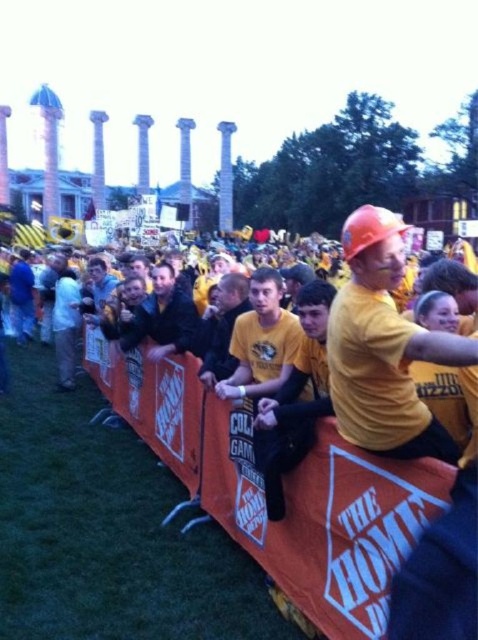
Question: Which point appears closest to the camera in this image?

Choices:
 (A) (90, 372)
 (B) (395, 365)

Answer: (B)

Question: Does orange fabric barrier at center have a lesser width compared to matte orange hard hat at center?

Choices:
 (A) yes
 (B) no

Answer: (B)

Question: Can you confirm if orange fabric barrier at center is bigger than matte orange hard hat at center?

Choices:
 (A) no
 (B) yes

Answer: (B)

Question: Which point is farther from the camera taking this photo?

Choices:
 (A) 334,378
 (B) 294,600

Answer: (A)

Question: From the image, what is the correct spatial relationship of orange fabric barrier at center in relation to matte orange hard hat at center?

Choices:
 (A) left
 (B) right

Answer: (A)

Question: Which point is farther to the camera?

Choices:
 (A) matte orange hard hat at center
 (B) orange fabric barrier at center

Answer: (A)